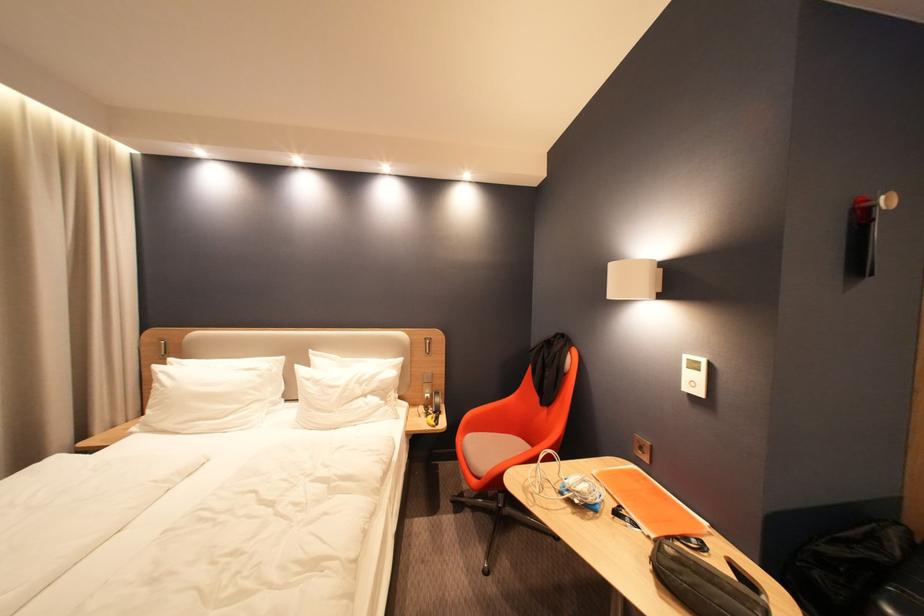
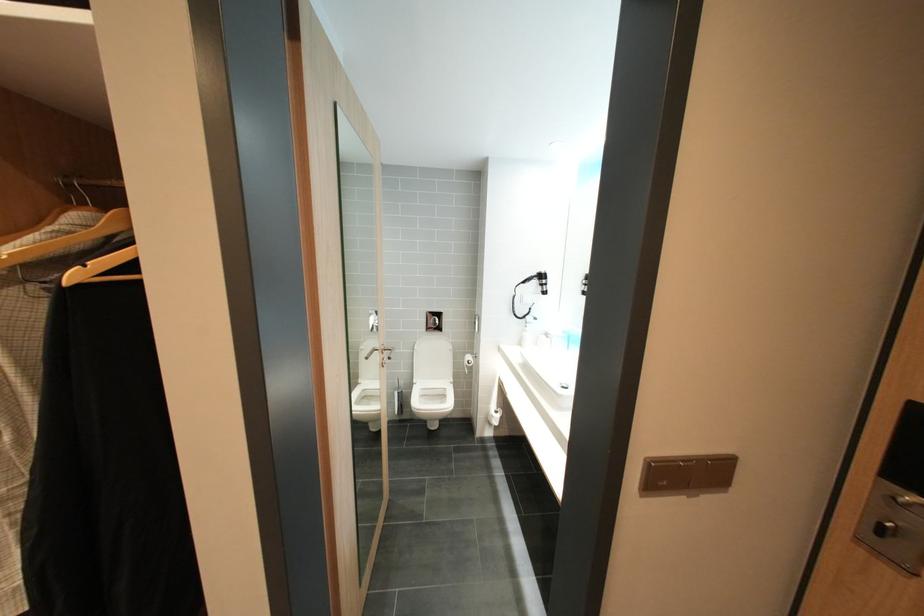
Question: What movement of the cameraman would produce the second image?

Choices:
 (A) Left
 (B) Right
 (C) Forward
 (D) Backward

Answer: (B)